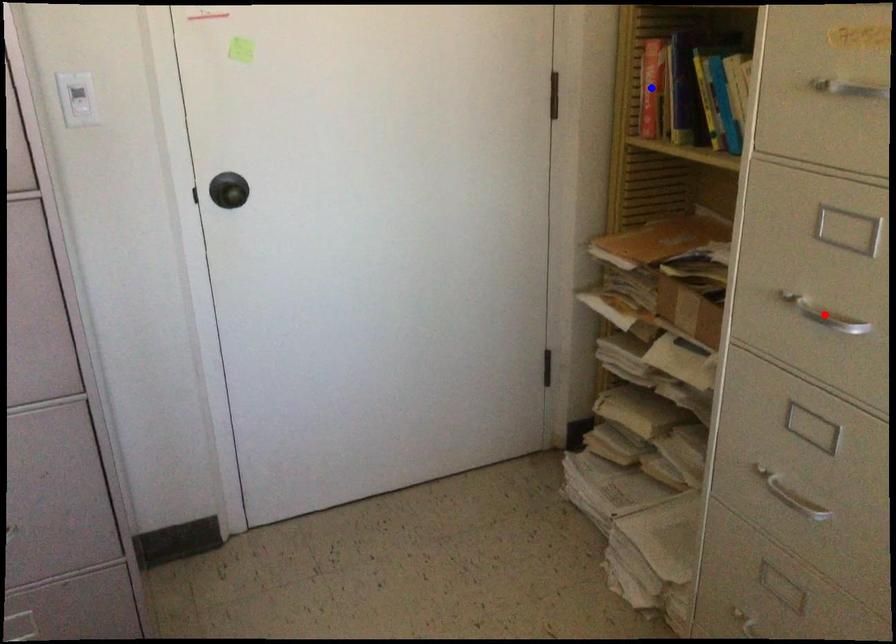
Question: Which of the two points in the image is closer to the camera?

Choices:
 (A) Blue point is closer.
 (B) Red point is closer.

Answer: (B)